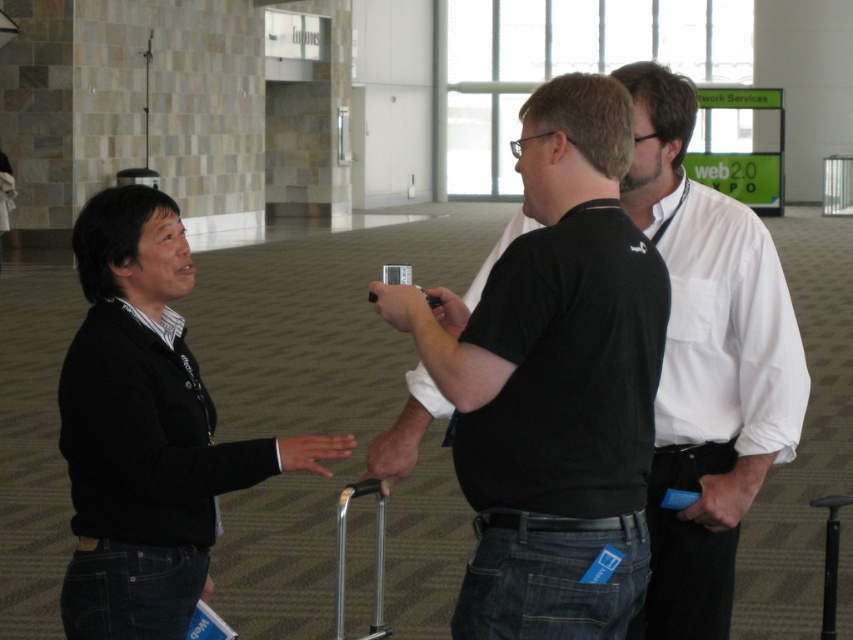
You are a photographer setting up a shoot in this room. You need to position a 1.8m tall tripod between the black matte shirt at center and the black sweater at left. Can the tripod fit vertically between them without exceeding their heights?

The black matte shirt at center is much taller than the black sweater at left. Since the tripod is 1.8m tall, it may not fit vertically between them if the shorter object, the black sweater at left, is not tall enough to accommodate the tripod height. However, the exact heights of the objects are not provided, so this cannot be definitively determined.

You are a photographer positioned at the entrance of the conference hall. You need to capture a photo where both the black matte shirt at center and the black sweater at left are visible. Based on their positions, which one will appear higher in the photo?

The black matte shirt at center will appear higher in the photo because it is positioned above the black sweater at left.